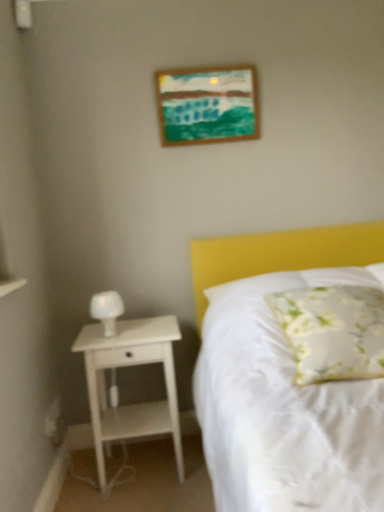
Image resolution: width=384 pixels, height=512 pixels. Find the location of `unoccupied area behind white matte bedside lamp at left`. unoccupied area behind white matte bedside lamp at left is located at coordinates (139, 323).